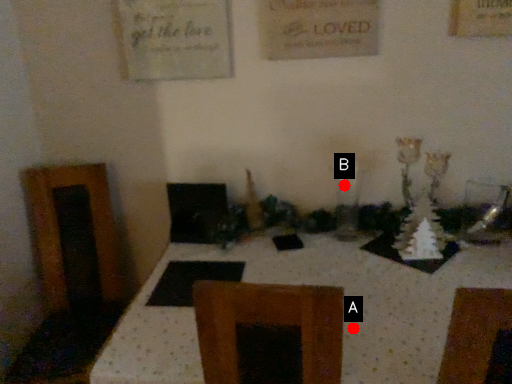
Question: Two points are circled on the image, labeled by A and B beside each circle. Which point is closer to the camera taking this photo?

Choices:
 (A) A is closer
 (B) B is closer

Answer: (A)